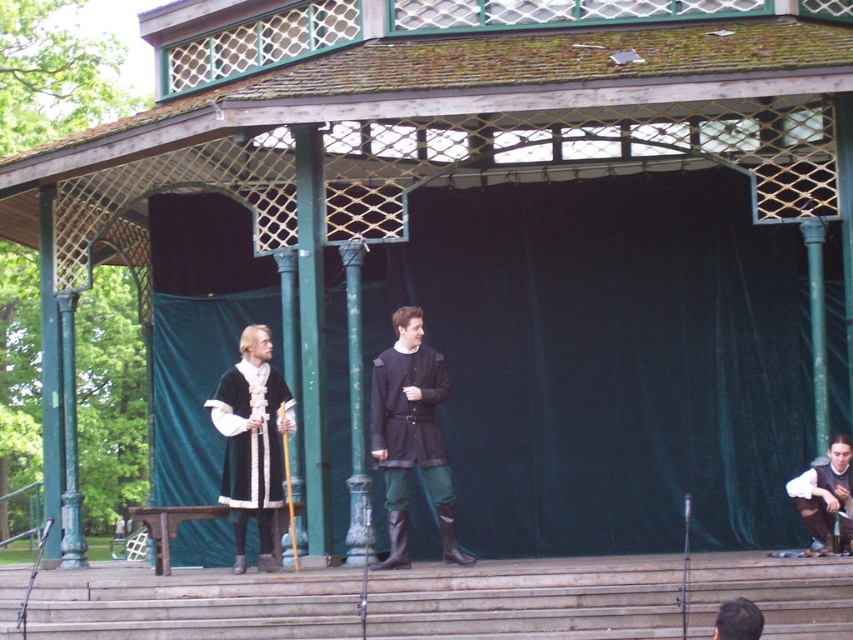
Can you confirm if dark brown leather boots at center is smaller than brown leather pants at lower right?

Correct, dark brown leather boots at center occupies less space than brown leather pants at lower right.

Measure the distance between point [392,451] and camera.

Point [392,451] is 153.76 feet away from camera.

Who is more forward, (392, 557) or (842, 524)?

Point (842, 524)

This screenshot has height=640, width=853. What are the coordinates of `dark brown leather boots at center` in the screenshot? It's located at (410, 435).

Who is taller, dark brown leather boots at center or velvet black robe at center?

With more height is velvet black robe at center.

Does dark brown leather boots at center lie in front of velvet black robe at center?

That is False.

Is point (392, 314) farther from camera compared to point (271, 561)?

Yes, it is.

I want to click on dark brown leather boots at center, so click(x=410, y=435).

In the scene shown: Can you confirm if velvet black robe at center is shorter than brown hair at lower right?

No, velvet black robe at center is not shorter than brown hair at lower right.

Does point (260, 396) come farther from viewer compared to point (759, 634)?

Yes, it is behind point (759, 634).

Is point (238, 348) positioned before point (738, 618)?

No, it is not.

This screenshot has height=640, width=853. Identify the location of velvet black robe at center. (252, 442).